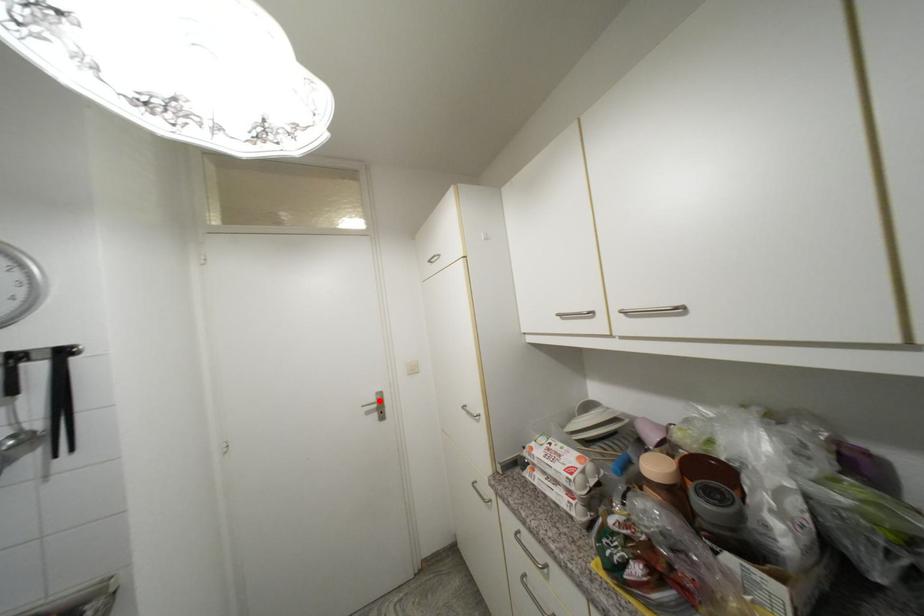
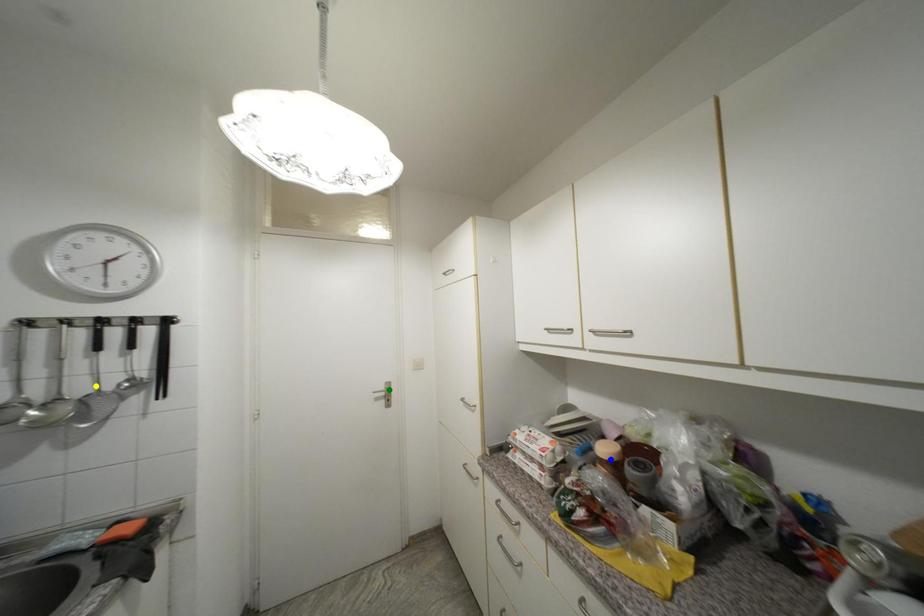
Question: I am providing you with two images of the same scene from different viewpoints. A red point is marked on the first image. You are given multiple points on the second image. Which spot in image 2 lines up with the point in image 1?

Choices:
 (A) yellow point
 (B) blue point
 (C) green point

Answer: (C)